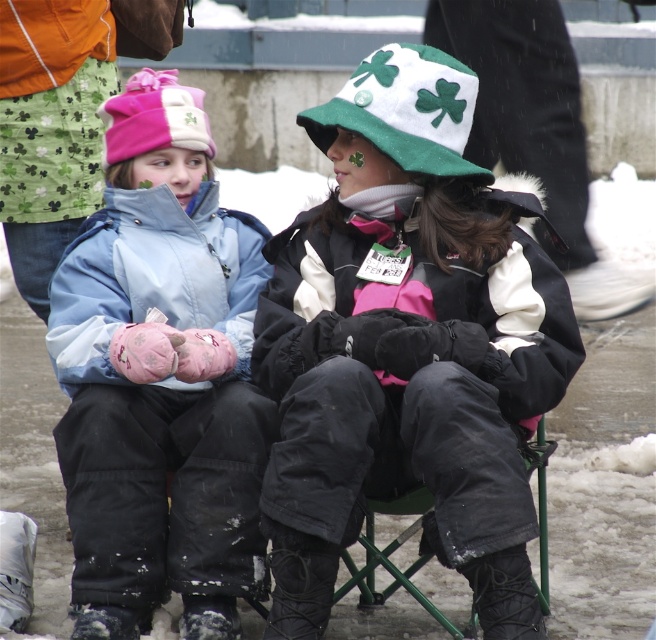
Looking at this image, you are standing in the snowy area and see a point marked at coordinates (159, 378). Which object is this point located on?

The point at (159, 378) is located on the matte blue jacket at center.

You are a photographer trying to capture a photo of the white matte hat at center and the matte blue jacket at center. Since you want to ensure both are fully visible in the frame, which object should you focus on first to avoid cropping the shorter one?

The white matte hat at center is shorter than the matte blue jacket at center, so you should focus on the white matte hat at center first to ensure it is fully visible in the frame.

You are a photographer trying to capture the matte blue jacket at center in your shot. Based on the coordinates provided, where should you position your camera to ensure the jacket is centered in the frame?

The matte blue jacket at center is located at coordinates point (159, 378), so positioning the camera to center on those coordinates will ensure the jacket is centered in the frame.